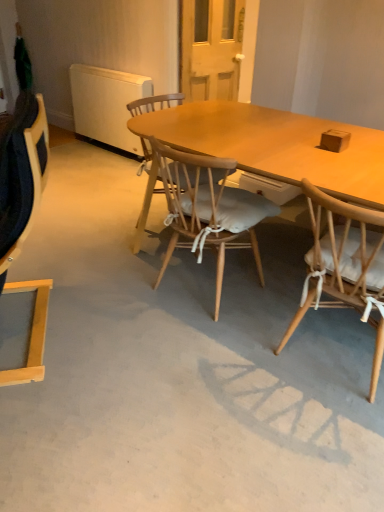
I want to click on unoccupied area in front of light wood chair at left, placed as the first chair when sorted from left to right, so click(x=54, y=422).